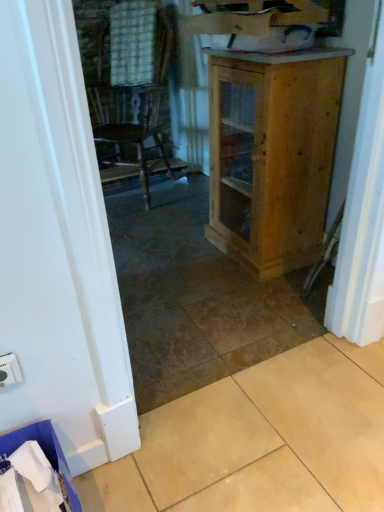
Question: Visually, is natural wood cabinet at center positioned to the left or to the right of white plastic electric outlet at lower left?

Choices:
 (A) right
 (B) left

Answer: (A)

Question: Is point (218, 164) closer or farther from the camera than point (13, 364)?

Choices:
 (A) farther
 (B) closer

Answer: (A)

Question: Which object is positioned closest to the natural wood cabinet at center?

Choices:
 (A) beige tile at lower right
 (B) white plastic electric outlet at lower left

Answer: (A)

Question: Based on their relative distances, which object is nearer to the white plastic electric outlet at lower left?

Choices:
 (A) natural wood cabinet at center
 (B) beige tile at lower right

Answer: (B)